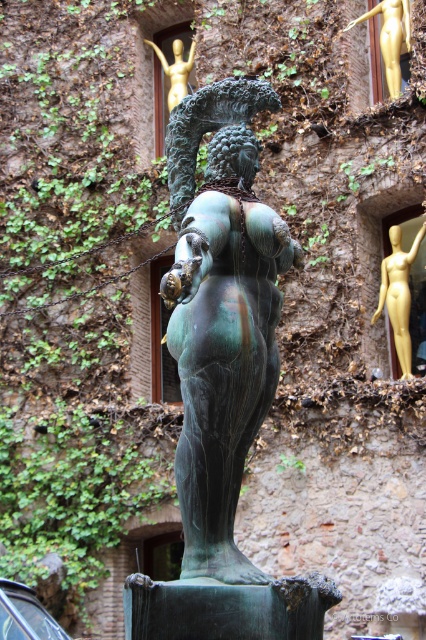
Question: Which object is closer to the camera taking this photo?

Choices:
 (A) gold metallic statue at upper center
 (B) bronze statue at center

Answer: (B)

Question: Which object appears farthest from the camera in this image?

Choices:
 (A) gold metallic statue at upper center
 (B) bronze statue at center

Answer: (A)

Question: Is bronze statue at center bigger than gold metallic statue at upper center?

Choices:
 (A) no
 (B) yes

Answer: (B)

Question: Observing the image, what is the correct spatial positioning of bronze statue at center in reference to gold metallic statue at upper center?

Choices:
 (A) above
 (B) below

Answer: (A)

Question: Does bronze statue at center have a larger size compared to gold metallic statue at upper center?

Choices:
 (A) yes
 (B) no

Answer: (A)